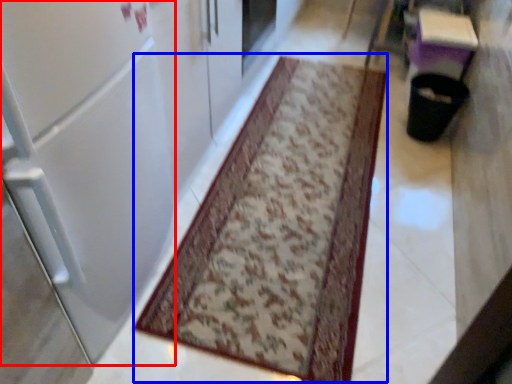
Question: Which of the following is the farthest to the observer, door (highlighted by a red box) or mat (highlighted by a blue box)?

Choices:
 (A) door
 (B) mat

Answer: (B)